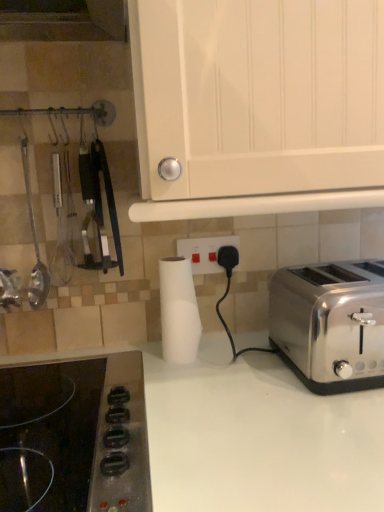
Question: In terms of height, does satin silver toaster at right look taller or shorter compared to black glass cooktop at lower left?

Choices:
 (A) tall
 (B) short

Answer: (A)

Question: Is satin silver toaster at right to the left or to the right of black glass cooktop at lower left in the image?

Choices:
 (A) right
 (B) left

Answer: (A)

Question: Which is farther from the satin silver toaster at right?

Choices:
 (A) white glossy cabinet at upper center
 (B) metallic silver ladle at left
 (C) black glass cooktop at lower left
 (D) white plastic power outlet at center
 (E) white matte paper towel at center

Answer: (B)

Question: Based on their relative distances, which object is nearer to the black glass cooktop at lower left?

Choices:
 (A) satin silver toaster at right
 (B) white plastic power outlet at center
 (C) white glossy cabinet at upper center
 (D) metallic silver ladle at left
 (E) white matte paper towel at center

Answer: (E)